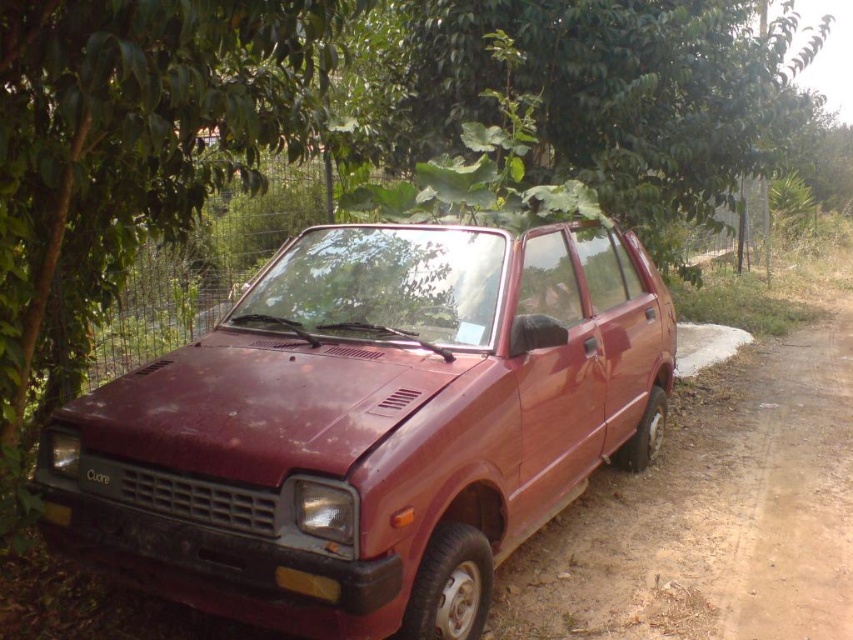
You are a photographer trying to capture the dull red car at center and the yellow matte license plate at front in a single shot. Since the camera can only focus on one object at a time, which object should you focus on to ensure it appears larger in the photo?

The dull red car at center should be focused on because it has a greater height compared to the yellow matte license plate at front, making it naturally larger in the photo.

Based on the photo, you are a drone operator trying to capture aerial footage of the maroon car parked on the dirt path. You have two markers labeled point 1 at point (53, 522) and point 2 at point (97, 472). Which marker should you prioritize placing closer to the car to ensure the best angle for capturing the front grille and headlights?

Point 2 at point (97, 472) should be prioritized because it is closer to the car than point 1 at point (53, 522), which is behind it.